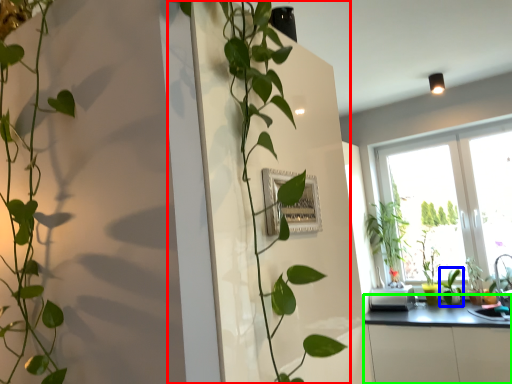
Question: Estimate the real-world distances between objects in this image. Which object is closer to houseplant (highlighted by a red box), plant (highlighted by a blue box) or counter top (highlighted by a green box)?

Choices:
 (A) plant
 (B) counter top

Answer: (B)